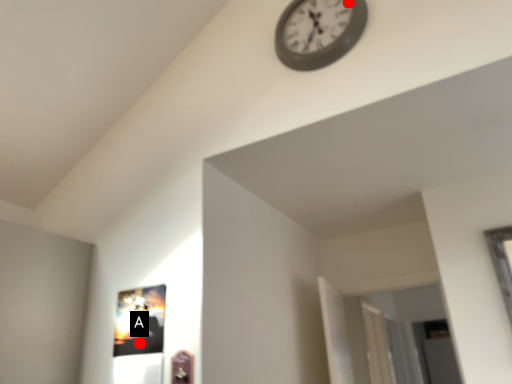
Question: Two points are circled on the image, labeled by A and B beside each circle. Which point is farther from the camera taking this photo?

Choices:
 (A) A is further
 (B) B is further

Answer: (B)